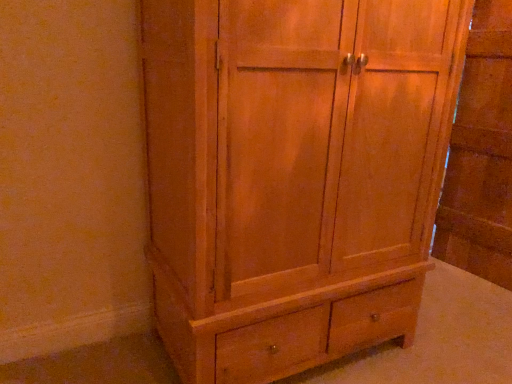
Question: Is natural wood cupboard at center located outside natural wood cabinet at right?

Choices:
 (A) yes
 (B) no

Answer: (A)

Question: Does natural wood cupboard at center have a greater height compared to natural wood cabinet at right?

Choices:
 (A) no
 (B) yes

Answer: (A)

Question: From the image's perspective, does natural wood cupboard at center appear higher than natural wood cabinet at right?

Choices:
 (A) yes
 (B) no

Answer: (B)

Question: From a real-world perspective, does natural wood cupboard at center sit lower than natural wood cabinet at right?

Choices:
 (A) no
 (B) yes

Answer: (B)

Question: Is natural wood cupboard at center in front of natural wood cabinet at right?

Choices:
 (A) no
 (B) yes

Answer: (B)

Question: From a real-world perspective, does natural wood cupboard at center stand above natural wood cabinet at right?

Choices:
 (A) no
 (B) yes

Answer: (A)

Question: From the image's perspective, would you say natural wood cabinet at right is shown under natural wood cupboard at center?

Choices:
 (A) yes
 (B) no

Answer: (B)

Question: Is natural wood cabinet at right to the left of natural wood cupboard at center from the viewer's perspective?

Choices:
 (A) yes
 (B) no

Answer: (B)

Question: Does natural wood cabinet at right have a lesser height compared to natural wood cupboard at center?

Choices:
 (A) yes
 (B) no

Answer: (B)

Question: Considering the relative sizes of natural wood cabinet at right and natural wood cupboard at center in the image provided, is natural wood cabinet at right thinner than natural wood cupboard at center?

Choices:
 (A) yes
 (B) no

Answer: (A)

Question: Considering the relative positions of natural wood cabinet at right and natural wood cupboard at center in the image provided, is natural wood cabinet at right in front of natural wood cupboard at center?

Choices:
 (A) no
 (B) yes

Answer: (A)

Question: Is natural wood cabinet at right touching natural wood cupboard at center?

Choices:
 (A) no
 (B) yes

Answer: (A)

Question: Considering the positions of natural wood cabinet at right and natural wood cupboard at center in the image, is natural wood cabinet at right wider or thinner than natural wood cupboard at center?

Choices:
 (A) thin
 (B) wide

Answer: (A)